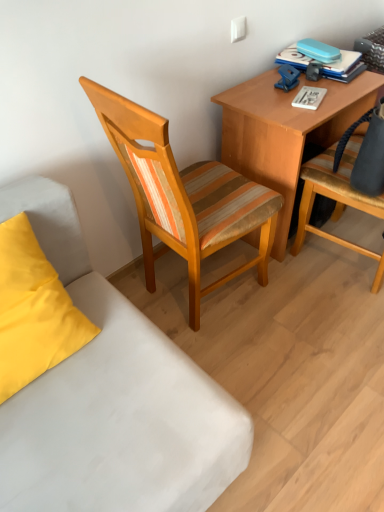
Question: Would you say matte yellow pillow at lower left is part of white fabric couch at lower left's contents?

Choices:
 (A) no
 (B) yes

Answer: (A)

Question: Does white fabric couch at lower left turn towards matte yellow pillow at lower left?

Choices:
 (A) yes
 (B) no

Answer: (B)

Question: Is white fabric couch at lower left in front of matte yellow pillow at lower left?

Choices:
 (A) yes
 (B) no

Answer: (B)

Question: Is the surface of white fabric couch at lower left in direct contact with matte yellow pillow at lower left?

Choices:
 (A) yes
 (B) no

Answer: (B)

Question: From a real-world perspective, is white fabric couch at lower left positioned under matte yellow pillow at lower left based on gravity?

Choices:
 (A) yes
 (B) no

Answer: (A)

Question: Is white fabric couch at lower left looking in the opposite direction of matte yellow pillow at lower left?

Choices:
 (A) no
 (B) yes

Answer: (A)

Question: From a real-world perspective, is striped fabric chair at right, the first chair viewed from the right, positioned under woodenchair at center, the first chair when ordered from left to right, based on gravity?

Choices:
 (A) no
 (B) yes

Answer: (B)

Question: Is striped fabric chair at right, placed as the 2th chair when sorted from left to right, not within woodenchair at center, the first chair when ordered from left to right?

Choices:
 (A) yes
 (B) no

Answer: (A)

Question: Considering the relative sizes of striped fabric chair at right, placed as the 2th chair when sorted from left to right, and woodenchair at center, the first chair when ordered from left to right, in the image provided, is striped fabric chair at right, placed as the 2th chair when sorted from left to right, wider than woodenchair at center, the first chair when ordered from left to right,?

Choices:
 (A) yes
 (B) no

Answer: (B)

Question: Can you confirm if striped fabric chair at right, placed as the 2th chair when sorted from left to right, is taller than woodenchair at center, marked as the second chair in a right-to-left arrangement?

Choices:
 (A) yes
 (B) no

Answer: (B)

Question: Can you confirm if striped fabric chair at right, the first chair viewed from the right, is bigger than woodenchair at center, the first chair when ordered from left to right?

Choices:
 (A) yes
 (B) no

Answer: (B)

Question: From the image's perspective, does striped fabric chair at right, the first chair viewed from the right, appear higher than woodenchair at center, marked as the second chair in a right-to-left arrangement?

Choices:
 (A) yes
 (B) no

Answer: (A)

Question: Is blue hardcover book at upper right in front of woodenchair at center, the first chair when ordered from left to right?

Choices:
 (A) yes
 (B) no

Answer: (B)